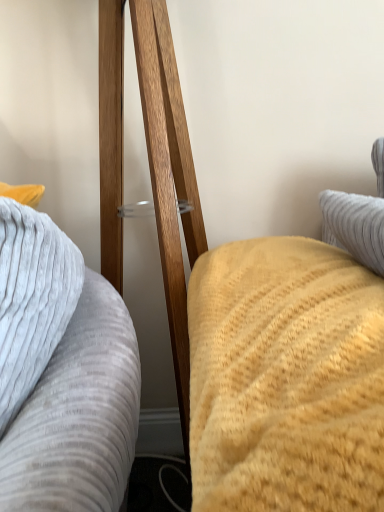
Question: From the image's perspective, does gray textured pillow at left, which is the 1th furniture from left to right, appear lower than yellow textured blanket at right, which is counted as the 2th furniture, starting from the left?

Choices:
 (A) yes
 (B) no

Answer: (A)

Question: Can you confirm if gray textured pillow at left, which is the 1th furniture from left to right, is thinner than yellow textured blanket at right, which is counted as the 2th furniture, starting from the left?

Choices:
 (A) yes
 (B) no

Answer: (A)

Question: Is gray textured pillow at left, which is the 1th furniture from left to right, wider than yellow textured blanket at right, which is counted as the 2th furniture, starting from the left?

Choices:
 (A) no
 (B) yes

Answer: (A)

Question: Is gray textured pillow at left, which is the 1th furniture from left to right, not within yellow textured blanket at right, acting as the 1th furniture starting from the right?

Choices:
 (A) no
 (B) yes

Answer: (B)

Question: Is the depth of gray textured pillow at left, positioned as the second furniture in right-to-left order, greater than that of yellow textured blanket at right, acting as the 1th furniture starting from the right?

Choices:
 (A) yes
 (B) no

Answer: (A)

Question: From the image's perspective, does gray textured pillow at left, which is the 1th furniture from left to right, appear higher than yellow textured blanket at right, which is counted as the 2th furniture, starting from the left?

Choices:
 (A) yes
 (B) no

Answer: (B)

Question: Considering the relative positions of yellow textured blanket at right, which is counted as the 2th furniture, starting from the left, and gray textured pillow at left, which is the 1th furniture from left to right, in the image provided, is yellow textured blanket at right, which is counted as the 2th furniture, starting from the left, to the left of gray textured pillow at left, which is the 1th furniture from left to right, from the viewer's perspective?

Choices:
 (A) yes
 (B) no

Answer: (B)

Question: Considering the relative sizes of yellow textured blanket at right, acting as the 1th furniture starting from the right, and gray textured pillow at left, which is the 1th furniture from left to right, in the image provided, is yellow textured blanket at right, acting as the 1th furniture starting from the right, bigger than gray textured pillow at left, which is the 1th furniture from left to right,?

Choices:
 (A) yes
 (B) no

Answer: (B)

Question: Does yellow textured blanket at right, which is counted as the 2th furniture, starting from the left, have a greater width compared to gray textured pillow at left, which is the 1th furniture from left to right?

Choices:
 (A) yes
 (B) no

Answer: (A)

Question: Is yellow textured blanket at right, acting as the 1th furniture starting from the right, far from gray textured pillow at left, positioned as the second furniture in right-to-left order?

Choices:
 (A) yes
 (B) no

Answer: (B)

Question: From a real-world perspective, is yellow textured blanket at right, which is counted as the 2th furniture, starting from the left, beneath gray textured pillow at left, positioned as the second furniture in right-to-left order?

Choices:
 (A) no
 (B) yes

Answer: (A)

Question: Is gray textured pillow at left, positioned as the second furniture in right-to-left order, surrounded by yellow textured blanket at right, which is counted as the 2th furniture, starting from the left?

Choices:
 (A) no
 (B) yes

Answer: (A)

Question: Considering the relative positions of yellow textured blanket at right, which is counted as the 2th furniture, starting from the left, and gray textured pillow at left, which is the 1th furniture from left to right, in the image provided, is yellow textured blanket at right, which is counted as the 2th furniture, starting from the left, to the left or to the right of gray textured pillow at left, which is the 1th furniture from left to right,?

Choices:
 (A) right
 (B) left

Answer: (A)